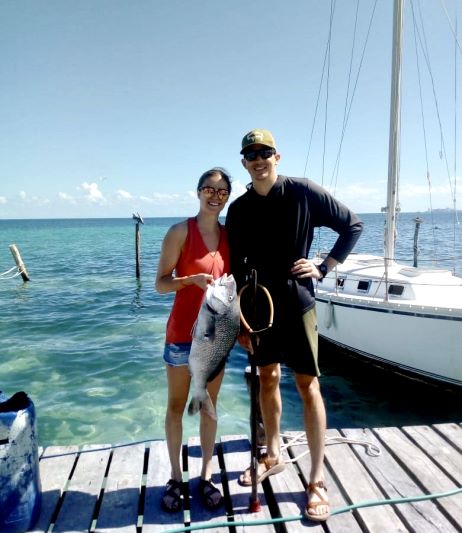
Where is `wires`? This screenshot has height=533, width=462. wires is located at coordinates (341, 131).